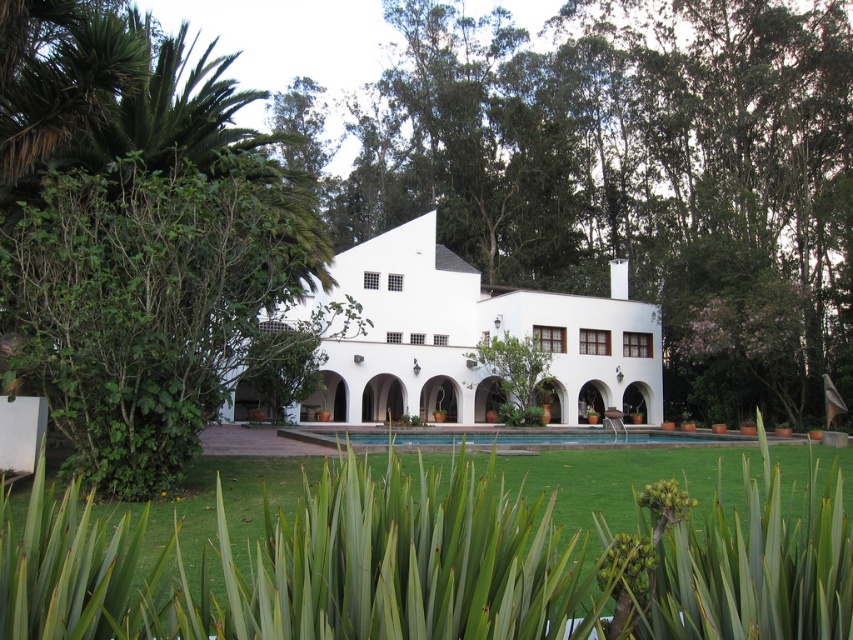
Question: Can you confirm if green leafy tree at left is positioned above white smooth villa at center?

Choices:
 (A) yes
 (B) no

Answer: (A)

Question: Considering the real-world distances, which object is closest to the white smooth villa at center?

Choices:
 (A) green leafy tree at center
 (B) green leafy tree at left
 (C) green grass at center

Answer: (B)

Question: Which object appears closest to the camera in this image?

Choices:
 (A) green leafy tree at center
 (B) green grass at center
 (C) green leafy tree at left

Answer: (B)

Question: Which of the following is the farthest from the observer?

Choices:
 (A) green grass at center
 (B) green leafy tree at left
 (C) white smooth villa at center

Answer: (C)

Question: Observing the image, what is the correct spatial positioning of green leafy tree at center in reference to green leafy tree at left?

Choices:
 (A) below
 (B) above

Answer: (B)

Question: Does green leafy tree at left have a larger size compared to white smooth villa at center?

Choices:
 (A) yes
 (B) no

Answer: (B)